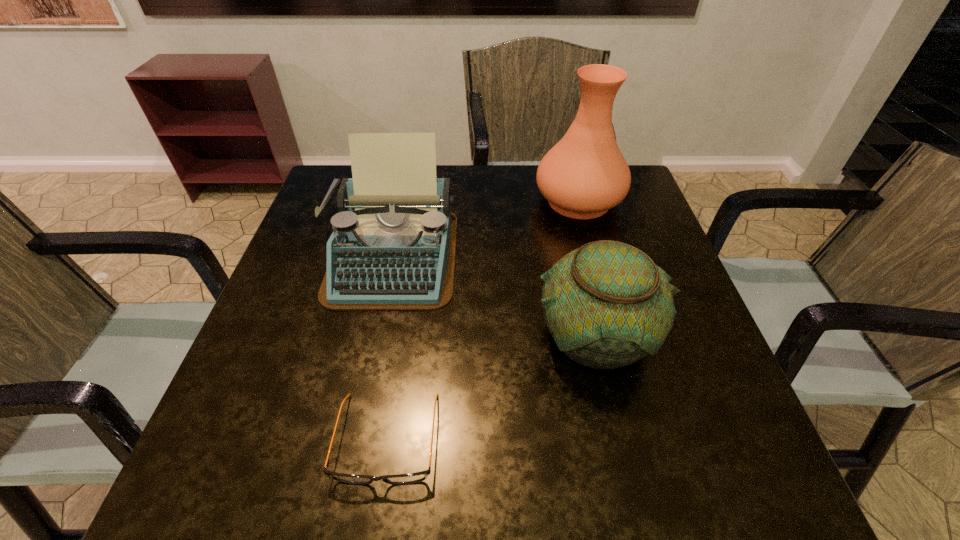
Find the location of a particular element. object at the near edge is located at coordinates (399, 479).

Identify the location of object that is at the left edge. (393, 247).

In order to click on vase located in the right edge section of the desktop in this screenshot , I will do `click(584, 175)`.

The height and width of the screenshot is (540, 960). I want to click on pottery present at the right edge, so click(x=606, y=304).

Find the location of a particular element. The image size is (960, 540). object that is at the far left corner is located at coordinates (393, 247).

Identify the location of object positioned at the far right corner. (584, 175).

Where is `free region at the far edge of the desktop`? free region at the far edge of the desktop is located at coordinates (538, 193).

Locate an element on the screen. The image size is (960, 540). vacant space at the left edge of the desktop is located at coordinates (295, 275).

Where is `vacant space at the right edge of the desktop`? vacant space at the right edge of the desktop is located at coordinates (636, 389).

Where is `free spot between the third tallest object and the nearest object`? Image resolution: width=960 pixels, height=540 pixels. free spot between the third tallest object and the nearest object is located at coordinates (491, 387).